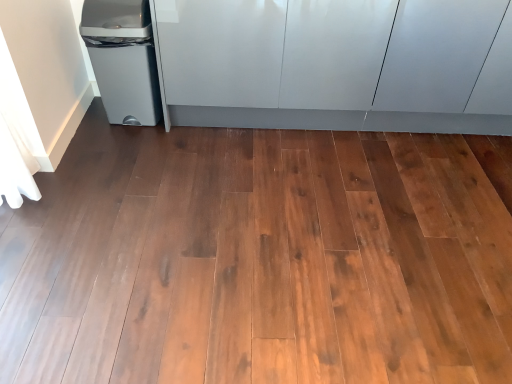
You are a GUI agent. You are given a task and a screenshot of the screen. Output one action in this format:
    pyautogui.click(x=<x>, y=<y>)
    Task: Click on the vacant area that lies to the right of white fabric curtain at left
    The height and width of the screenshot is (384, 512).
    Given the screenshot: What is the action you would take?
    pyautogui.click(x=79, y=196)